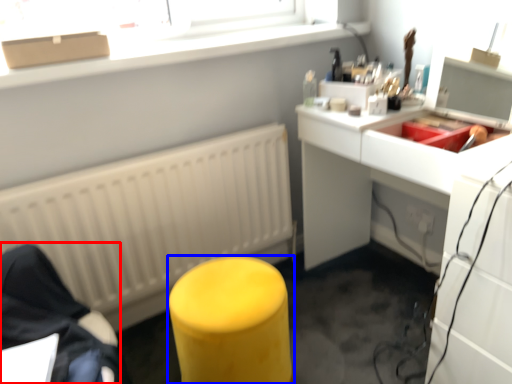
Question: Which object appears closest to the camera in this image, furniture (highlighted by a red box) or furniture (highlighted by a blue box)?

Choices:
 (A) furniture
 (B) furniture

Answer: (B)